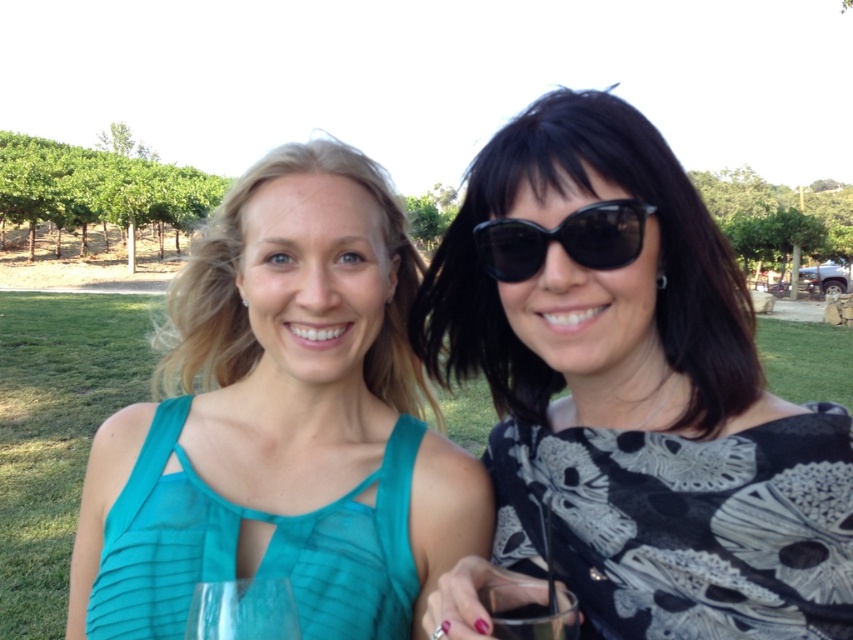
You are a photographer planning to capture a candid shot of the two women in the scene. You need to ensure that the black printed dress at center and the transparent glass at center are both clearly visible in the frame. Given their sizes, which object would require you to adjust your camera angle to avoid cropping? Please explain your reasoning based on their relative sizes.

The black printed dress at center is wider than the transparent glass at center. Therefore, to ensure both are fully visible without cropping, you would need to adjust the camera angle to accommodate the wider width of the black printed dress at center.

You are a photographer setting up for a photoshoot in the park. You have a black printed dress at center and a transparent glass at center in your frame. Which object should you adjust in your camera to ensure proper focus if the transparent glass is causing reflections? Explain your reasoning.

The black printed dress at center is taller than the transparent glass at center. Since the dress is taller, adjusting focus on it would likely ensure the glass is also in focus due to its closer proximity in the frame. Alternatively, focusing on the glass might require adjusting the dress out of focus, which is less ideal as it is the primary subject.

You are a photographer setting up a shoot in the park. You notice the black printed fabric dress at right and the black plastic sunglasses at center. Which object should you adjust your camera focus on first if you want to capture both in the same frame, considering their sizes?

The black printed fabric dress at right is taller than the black plastic sunglasses at center, so you should focus on the dress first to ensure it is in clear view before adjusting for the smaller sunglasses.